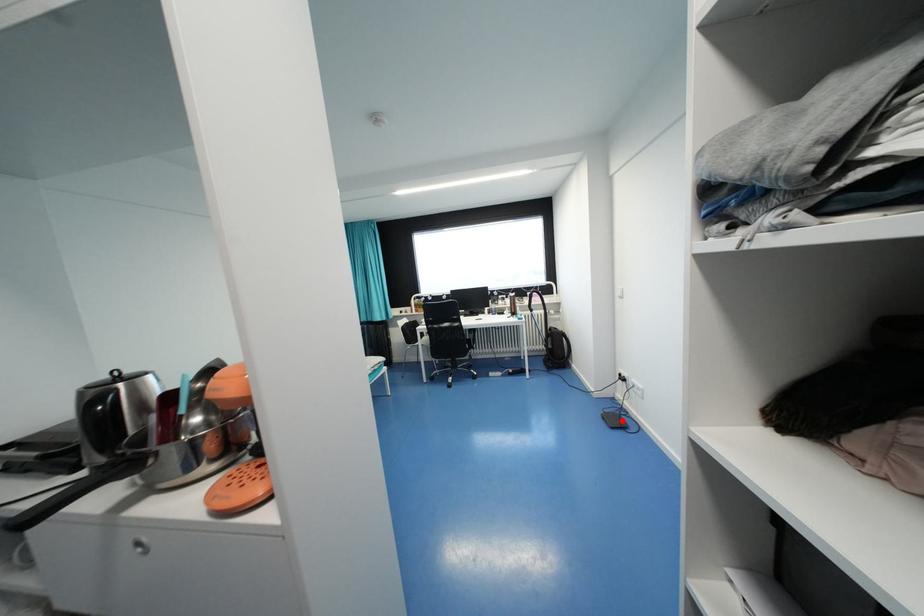
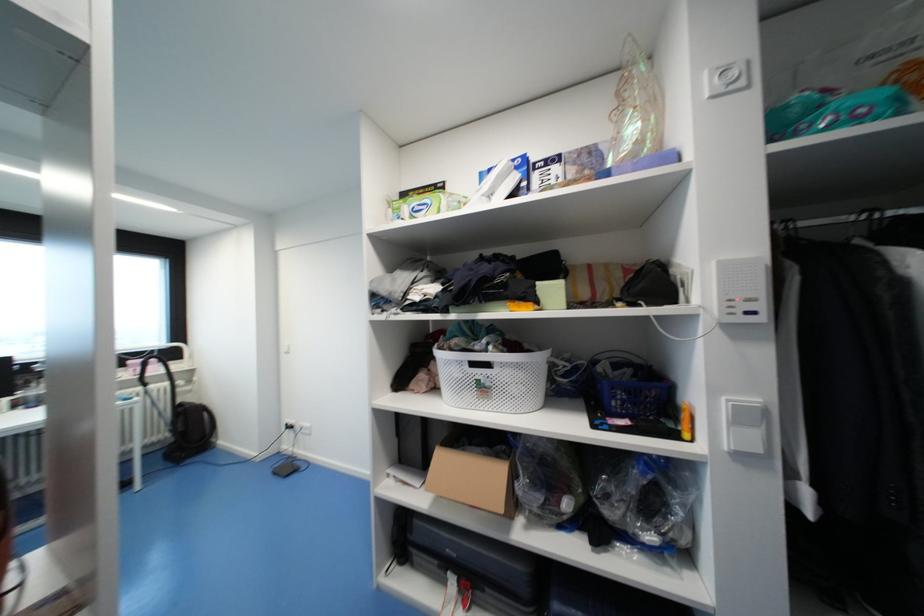
Where in the second image is the point corresponding to the highlighted location from the first image?

(293, 469)